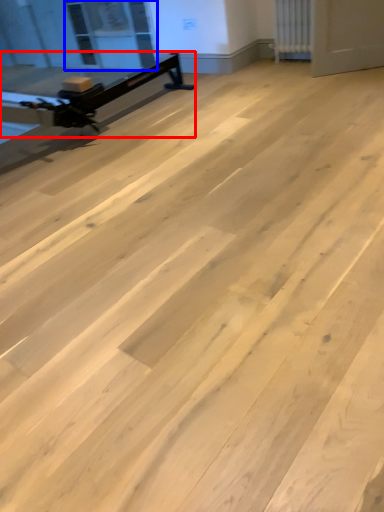
Question: Which of the following is the farthest to the observer, furniture (highlighted by a red box) or window screen (highlighted by a blue box)?

Choices:
 (A) furniture
 (B) window screen

Answer: (B)